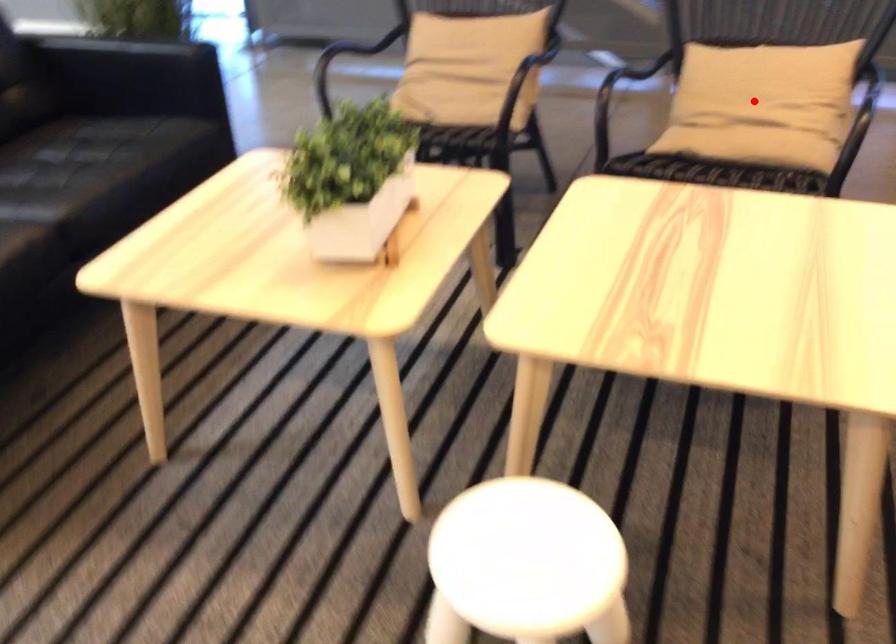
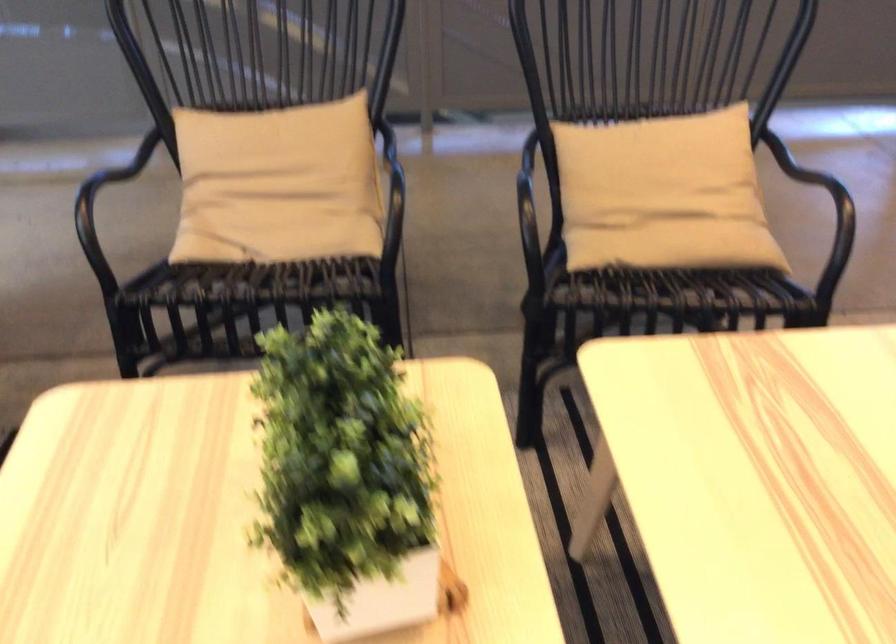
Question: I am providing you with two images of the same scene from different viewpoints. A red point is shown in image1. For the corresponding object point in image2, is it positioned nearer or farther from the camera?

Choices:
 (A) Nearer
 (B) Farther

Answer: (A)